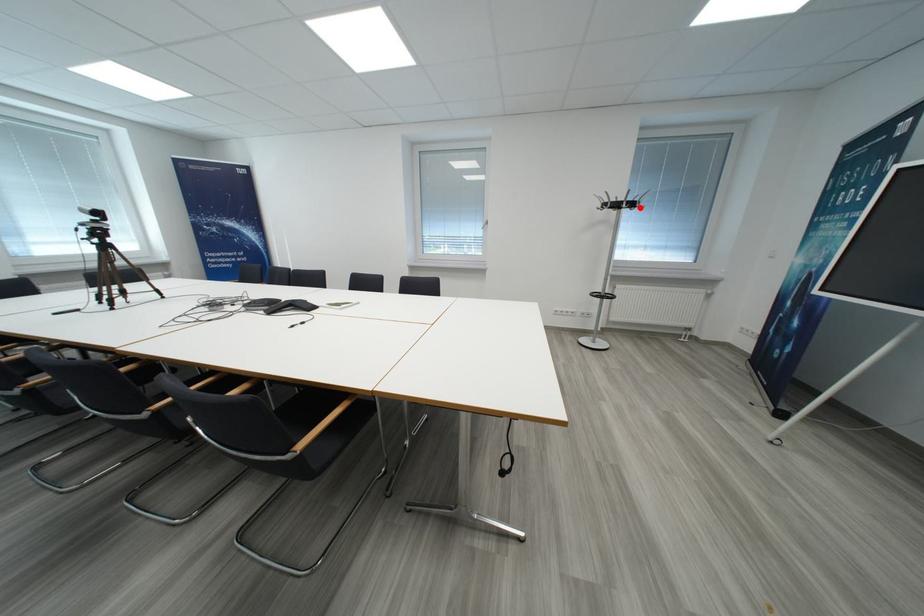
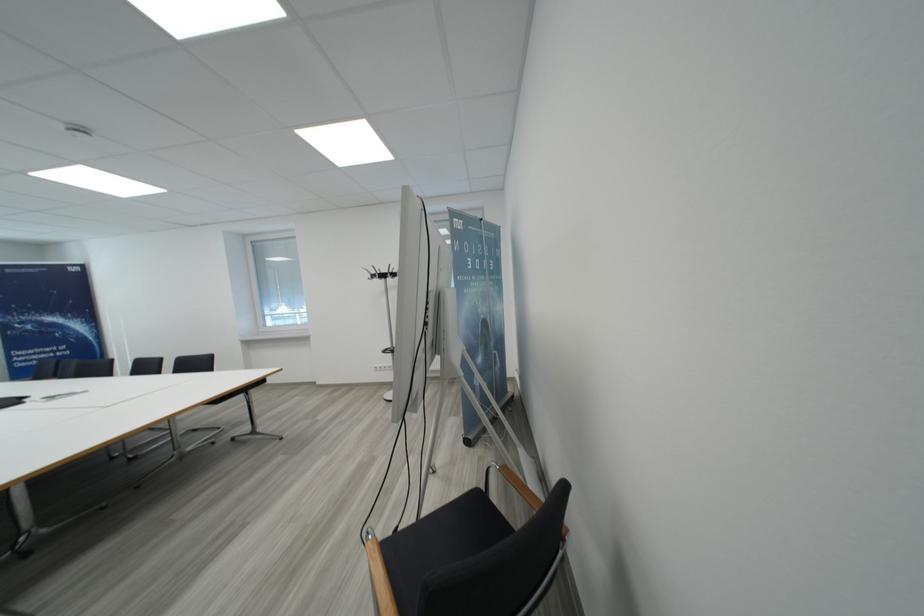
In the second image, find the point that corresponds to the highlighted location in the first image.

(390, 278)